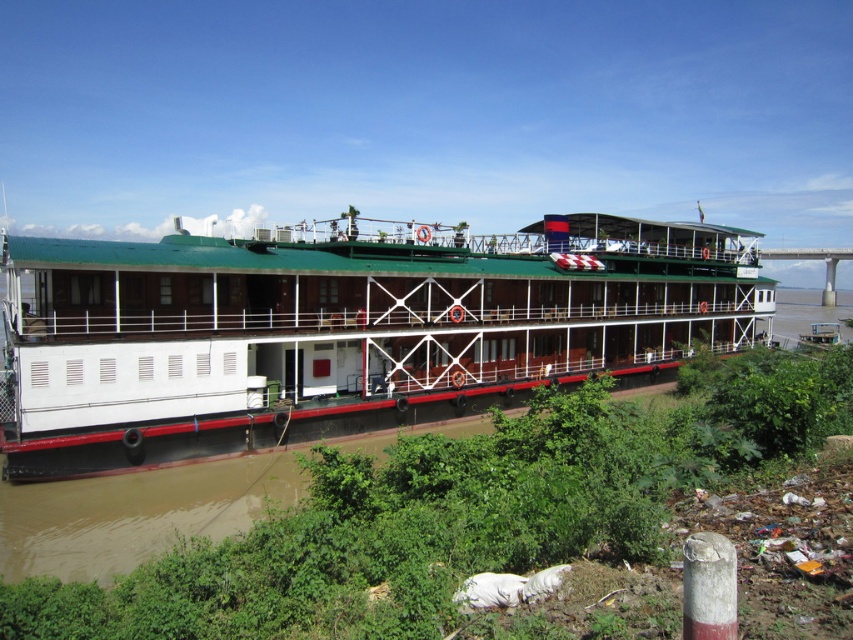
Looking at this image, you are standing on the riverbank and want to take a photo of the white matte boat at center and the green leafy vegetation at lower center. Which object should you focus on first if you want to capture both in a single frame without moving the camera?

You should focus on the white matte boat at center first because it is closer to you than the green leafy vegetation at lower center, allowing both to be in focus if you set the focus on the closer object.

You are standing on the riverbank looking at the boat. Based on the coordinates provided, can you identify the object located at point [344,330]?

The point [344,330] marks the white matte boat at center.